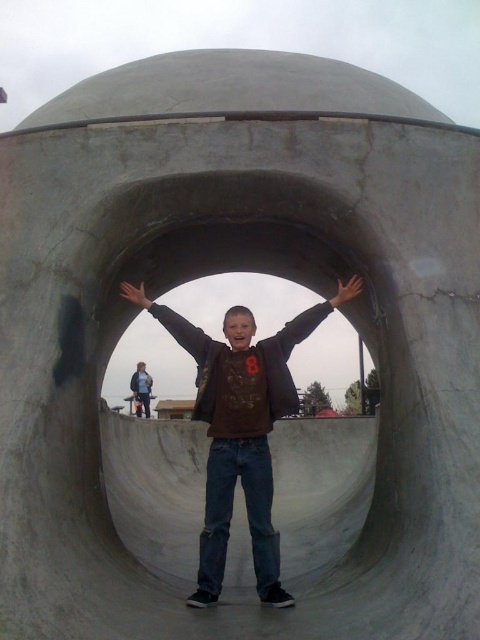
You are a photographer trying to capture the boy in the center wearing a matte brown sweatshirt at center. You want to ensure the boy is centered in your photo. Based on the coordinates provided, is the point you should focus on for the center of the photo located at point (x=240, y=435)?

Yes, the matte brown sweatshirt at center is represented by point (x=240, y=435), so focusing on that point will center the boy in the photo.

You are a photographer trying to capture the boy in the skatepark. You notice two hands in the image, the light brown leather hand at center and the black matte hand at center. Which hand should you focus on if you want to photograph the larger one?

The black matte hand at center is larger than the light brown leather hand at center, so you should focus on the black matte hand at center.

You are a photographer standing at the entrance of the skatepark. You want to take a photo of the matte brown sweatshirt at center. Can you capture it in your shot if your camera has a 50mm lens?

The matte brown sweatshirt at center is 38.96 meters away from camera. A 50mm lens has a standard field of view, but at 38.96 meters distance, the sweatshirt would likely be too small to be clearly visible in the photo. You might need a telephoto lens with a longer focal length to capture it effectively.